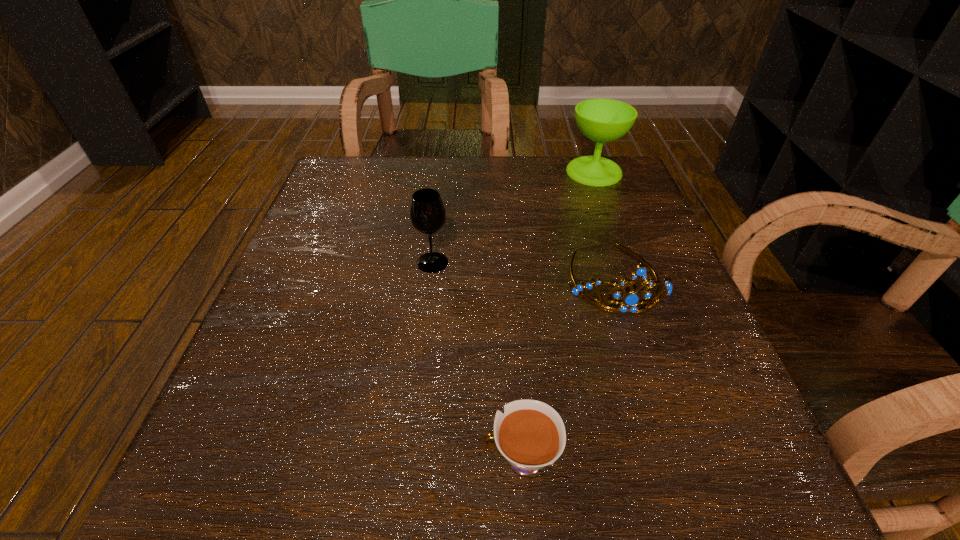
Identify the location of free space between the second object from left to right and the leftmost object. (476, 361).

Find the location of `vacant region between the right wineglass and the second shortest object`. vacant region between the right wineglass and the second shortest object is located at coordinates (605, 225).

You are a GUI agent. You are given a task and a screenshot of the screen. Output one action in this format:
    pyautogui.click(x=<x>, y=<y>)
    Task: Click on the vacant area between the second shortest object and the shortest object
    
    Given the screenshot: What is the action you would take?
    pyautogui.click(x=568, y=369)

The height and width of the screenshot is (540, 960). I want to click on free space between the left wineglass and the nearest object, so click(476, 361).

Identify the location of empty space between the leftmost object and the farthest object. (514, 217).

At what (x,y) coordinates should I click in order to perform the action: click on free spot between the leftmost object and the third tallest object. Please return your answer as a coordinate pair (x, y). The image size is (960, 540). Looking at the image, I should click on (524, 271).

You are a GUI agent. You are given a task and a screenshot of the screen. Output one action in this format:
    pyautogui.click(x=<x>, y=<y>)
    Task: Click on the object that is the closest to the third tallest object
    The width and height of the screenshot is (960, 540).
    Given the screenshot: What is the action you would take?
    pyautogui.click(x=530, y=435)

The width and height of the screenshot is (960, 540). I want to click on object that is the third closest one to the tiara, so click(x=427, y=212).

Identify the location of free point that satisfies the following two spatial constraints: 1. on the front-facing side of the tiara; 2. on the side of the third object from right to left with the handle. Image resolution: width=960 pixels, height=540 pixels. (673, 459).